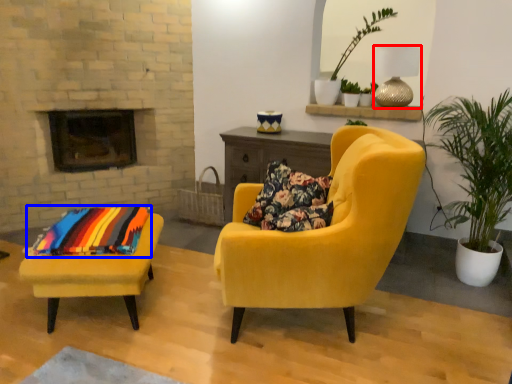
Question: Which of the following is the closest to the observer, lamp (highlighted by a red box) or blanket (highlighted by a blue box)?

Choices:
 (A) lamp
 (B) blanket

Answer: (B)